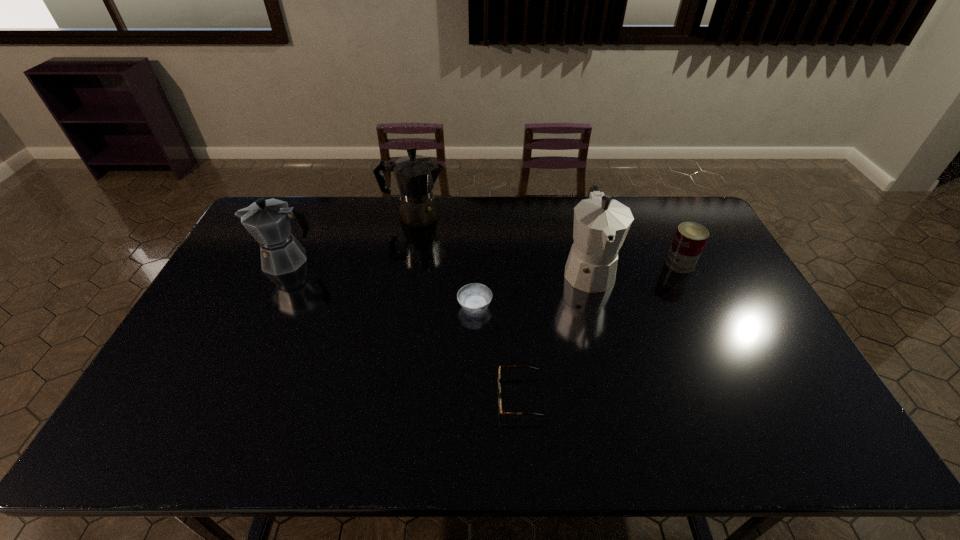
At what (x,y) coordinates should I click in order to perform the action: click on object that is at the near edge. Please return your answer as a coordinate pair (x, y). Looking at the image, I should click on (499, 387).

Where is `object that is at the left edge`? object that is at the left edge is located at coordinates (268, 221).

Locate an element on the screen. The image size is (960, 540). object at the right edge is located at coordinates (690, 238).

Find the location of a particular element. free location at the far edge is located at coordinates (336, 203).

In the image, there is a desktop. Find the location of `free space at the near edge`. free space at the near edge is located at coordinates (511, 453).

The image size is (960, 540). In the image, there is a desktop. What are the coordinates of `free region at the left edge` in the screenshot? It's located at tap(228, 334).

The height and width of the screenshot is (540, 960). In the image, there is a desktop. Find the location of `vacant area at the right edge`. vacant area at the right edge is located at coordinates (714, 252).

The height and width of the screenshot is (540, 960). Find the location of `free space between the ashtray and the leftmost object`. free space between the ashtray and the leftmost object is located at coordinates (381, 283).

I want to click on empty space that is in between the second coffeepot from left to right and the fourth object from right to left, so click(444, 261).

You are a GUI agent. You are given a task and a screenshot of the screen. Output one action in this format:
    pyautogui.click(x=<x>, y=<y>)
    Task: Click on the vacant region between the can and the leftmost object
    This screenshot has height=540, width=960.
    Given the screenshot: What is the action you would take?
    pyautogui.click(x=484, y=262)